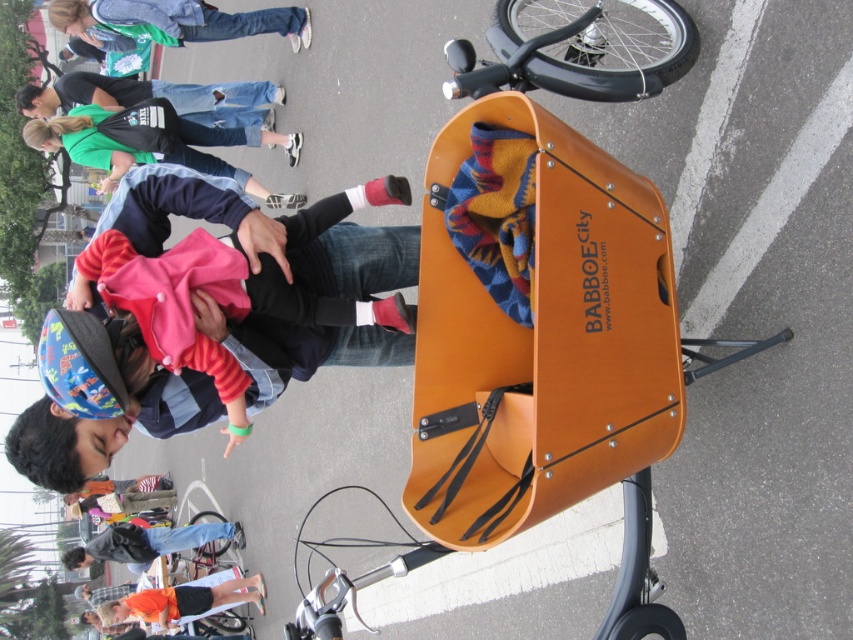
Can you confirm if matte green shirt at upper left is positioned above denim jeans at upper left?

No, matte green shirt at upper left is not above denim jeans at upper left.

Who is more forward, (262, 192) or (198, 100)?

Point (198, 100) is more forward.

Which is in front, point (132, 128) or point (229, 86)?

Positioned in front is point (132, 128).

This screenshot has width=853, height=640. I want to click on matte green shirt at upper left, so click(x=154, y=144).

At what (x,y) coordinates should I click in order to perform the action: click on matte green shirt at upper left. Please return your answer as a coordinate pair (x, y). Image resolution: width=853 pixels, height=640 pixels. Looking at the image, I should click on (154, 144).

Does point (137, 150) lie behind point (148, 589)?

No, it is in front of (148, 589).

Is point (196, 156) positioned before point (178, 612)?

Yes, point (196, 156) is in front of point (178, 612).

Find the location of a particular element. matte green shirt at upper left is located at coordinates (154, 144).

Can you confirm if soft pink fabric at center is positioned to the right of black leather jacket at lower left?

Yes, soft pink fabric at center is to the right of black leather jacket at lower left.

Does point (285, 378) come behind point (164, 538)?

No, it is not.

Describe the element at coordinates (317, 294) in the screenshot. The height and width of the screenshot is (640, 853). I see `soft pink fabric at center` at that location.

At what (x,y) coordinates should I click in order to perform the action: click on soft pink fabric at center. Please return your answer as a coordinate pair (x, y). Looking at the image, I should click on (317, 294).